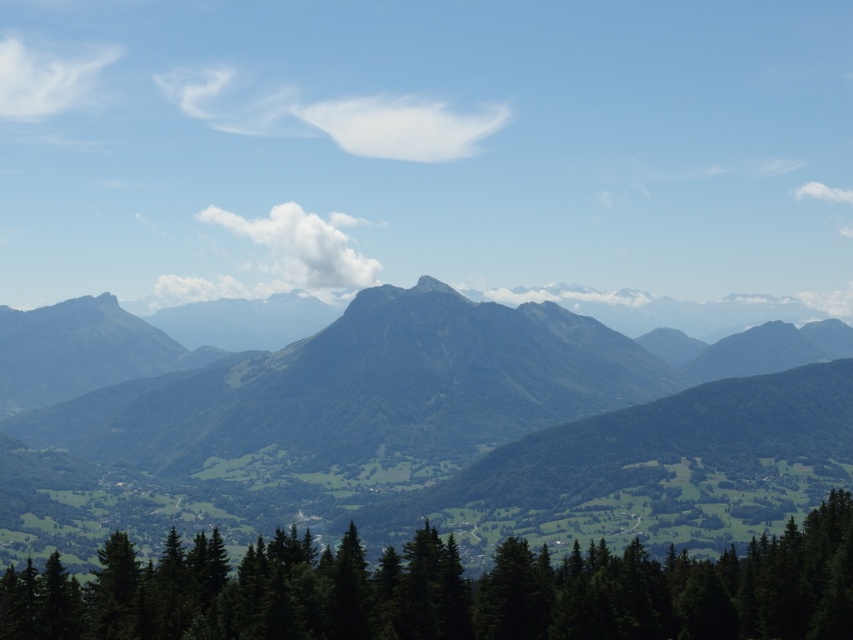
This screenshot has width=853, height=640. Identify the location of green textured mountain at center. (453, 432).